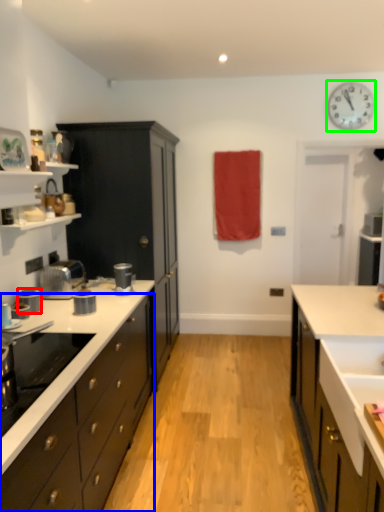
Question: Estimate the real-world distances between objects in this image. Which object is farther from kitchen appliance (highlighted by a red box), cabinetry (highlighted by a blue box) or clock (highlighted by a green box)?

Choices:
 (A) cabinetry
 (B) clock

Answer: (B)